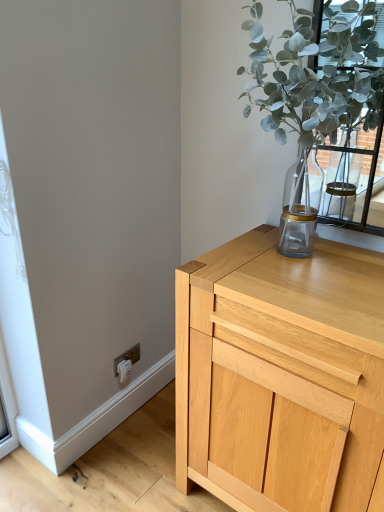
Where is `vacant area that is in front of green leafy plant at upper right`? This screenshot has width=384, height=512. vacant area that is in front of green leafy plant at upper right is located at coordinates (306, 296).